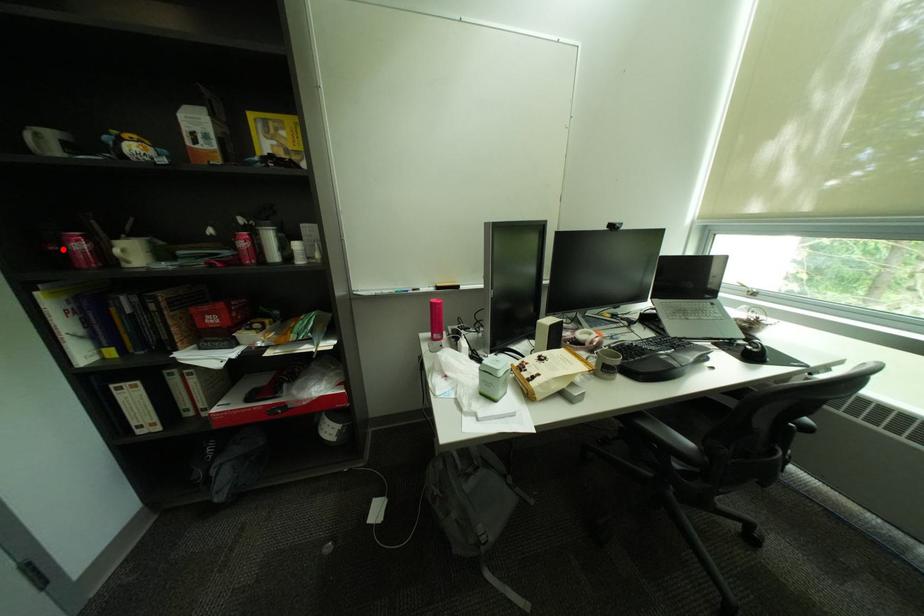
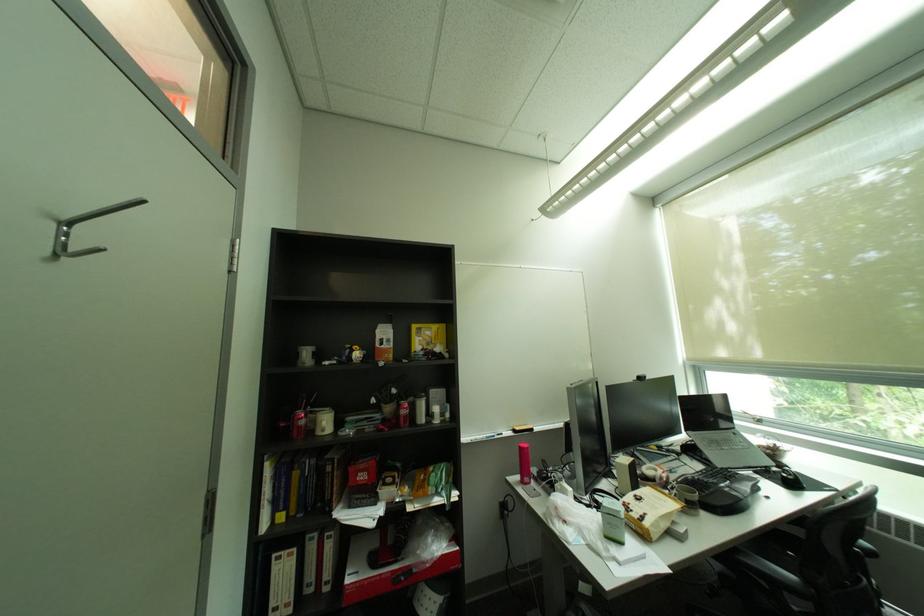
In the second image, find the point that corresponds to the highlighted location in the first image.

(293, 426)